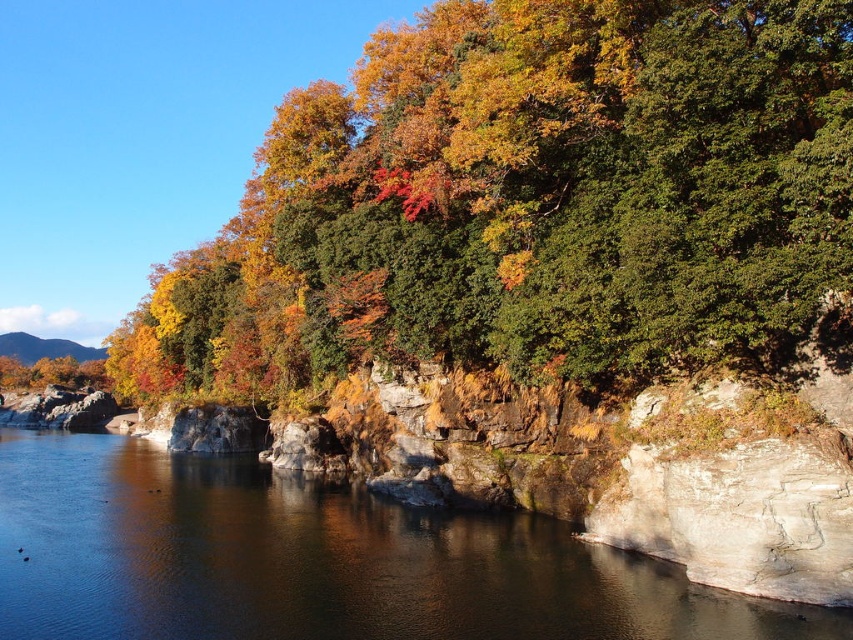
Consider the image. Can you confirm if autumn leaves at upper center is positioned to the right of smooth rock river at center?

In fact, autumn leaves at upper center is to the left of smooth rock river at center.

Based on the photo, between autumn leaves at upper center and smooth rock river at center, which one is positioned higher?

autumn leaves at upper center

Measure the distance between autumn leaves at upper center and camera.

The distance of autumn leaves at upper center from camera is 19.33 meters.

What are the coordinates of `autumn leaves at upper center` in the screenshot? It's located at (531, 202).